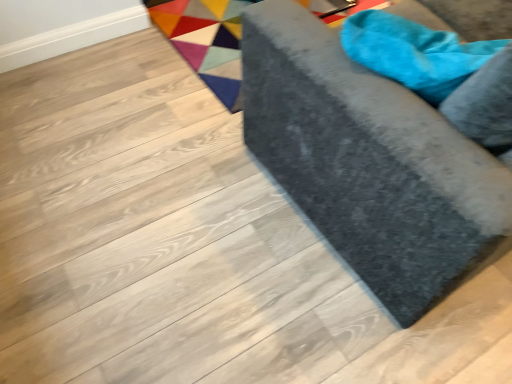
Describe the element at coordinates (368, 162) in the screenshot. This screenshot has width=512, height=384. I see `velvet grey sofa at right` at that location.

Find the location of a particular element. This screenshot has width=512, height=384. velvet grey sofa at right is located at coordinates (x=368, y=162).

Find the location of `velvet grey sofa at right`. velvet grey sofa at right is located at coordinates (368, 162).